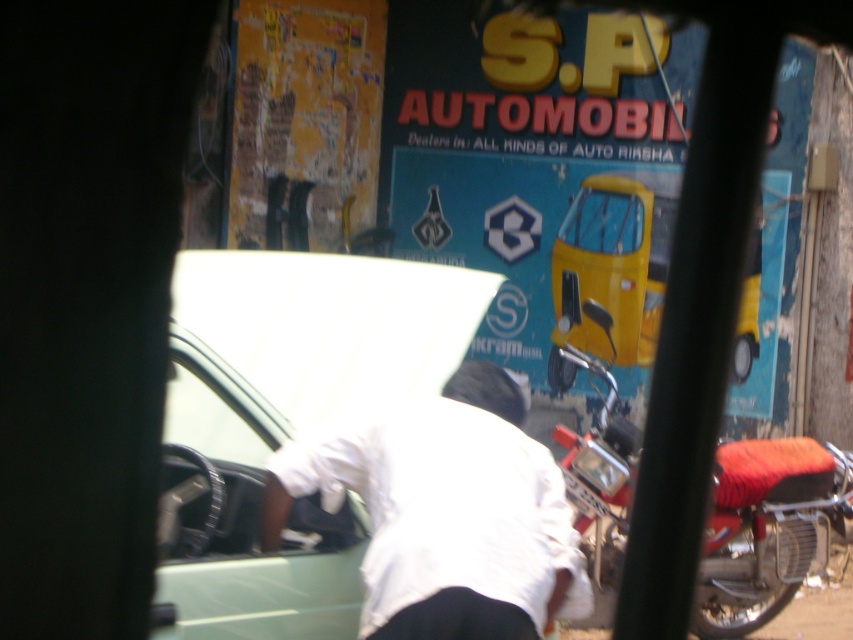
Is white cloth at center bigger than red leather motorcycle at right?

No.

Based on the photo, does white cloth at center appear over red leather motorcycle at right?

Indeed, white cloth at center is positioned over red leather motorcycle at right.

Where is `white cloth at center`? white cloth at center is located at coordinates (445, 502).